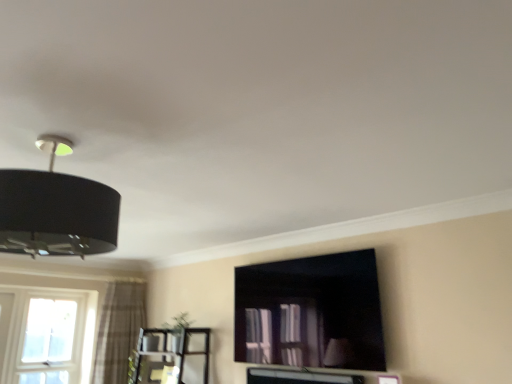
Question: Does black matte lampshade at upper left lie behind matte black tv cabinet at center?

Choices:
 (A) no
 (B) yes

Answer: (A)

Question: Does black matte lampshade at upper left have a lesser width compared to matte black tv cabinet at center?

Choices:
 (A) no
 (B) yes

Answer: (A)

Question: Can you confirm if black matte lampshade at upper left is positioned to the right of matte black tv cabinet at center?

Choices:
 (A) yes
 (B) no

Answer: (B)

Question: Is black matte lampshade at upper left far from matte black tv cabinet at center?

Choices:
 (A) yes
 (B) no

Answer: (A)

Question: Does black matte lampshade at upper left have a greater width compared to matte black tv cabinet at center?

Choices:
 (A) yes
 (B) no

Answer: (A)

Question: Considering the relative positions of black matte lampshade at upper left and matte black tv cabinet at center in the image provided, is black matte lampshade at upper left to the left of matte black tv cabinet at center from the viewer's perspective?

Choices:
 (A) yes
 (B) no

Answer: (A)

Question: Does matte black tv cabinet at center have a greater width compared to plaid fabric curtain at left?

Choices:
 (A) no
 (B) yes

Answer: (A)

Question: Is matte black tv cabinet at center to the right of plaid fabric curtain at left from the viewer's perspective?

Choices:
 (A) no
 (B) yes

Answer: (B)

Question: Are matte black tv cabinet at center and plaid fabric curtain at left making contact?

Choices:
 (A) no
 (B) yes

Answer: (A)

Question: Can you confirm if matte black tv cabinet at center is bigger than plaid fabric curtain at left?

Choices:
 (A) no
 (B) yes

Answer: (A)

Question: From the image's perspective, is matte black tv cabinet at center above plaid fabric curtain at left?

Choices:
 (A) yes
 (B) no

Answer: (A)

Question: Is matte black tv cabinet at center outside of plaid fabric curtain at left?

Choices:
 (A) yes
 (B) no

Answer: (A)

Question: Could you tell me if plaid fabric curtain at left is turned towards clear glass window at lower left?

Choices:
 (A) no
 (B) yes

Answer: (A)